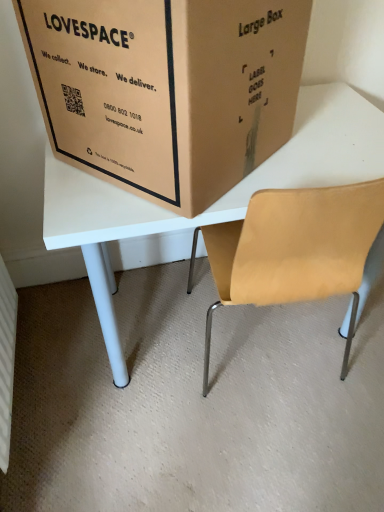
Locate an element on the screen. free space that is to the left of matte white table at center is located at coordinates (125, 362).